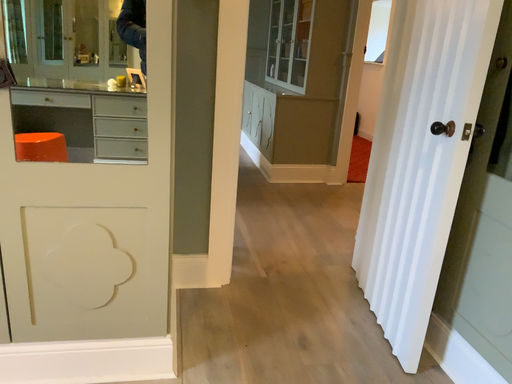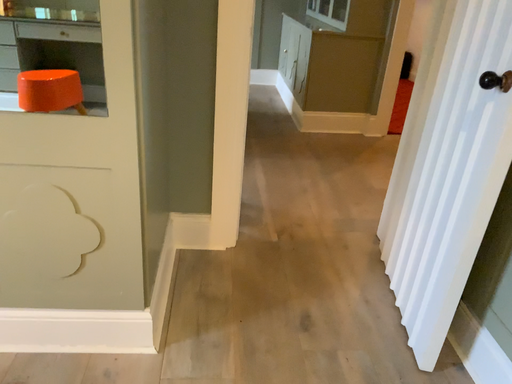
Question: How did the camera likely rotate when shooting the video?

Choices:
 (A) rotated downward
 (B) rotated upward

Answer: (A)